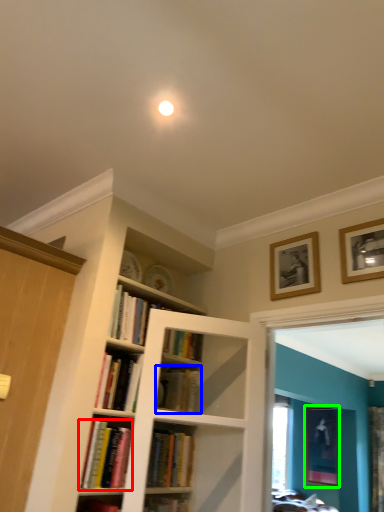
Question: Which is farther away from book (highlighted by a red box)? book (highlighted by a blue box) or picture frame (highlighted by a green box)?

Choices:
 (A) book
 (B) picture frame

Answer: (B)